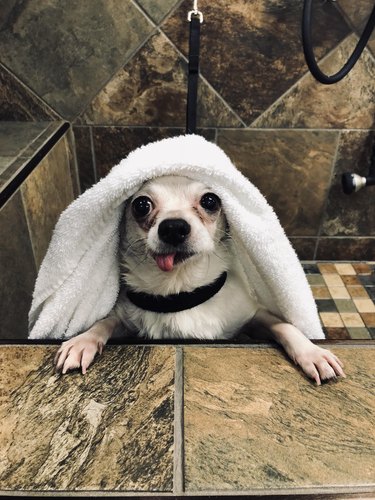
The image size is (375, 500). Find the location of `showerhead`. showerhead is located at coordinates click(355, 188).